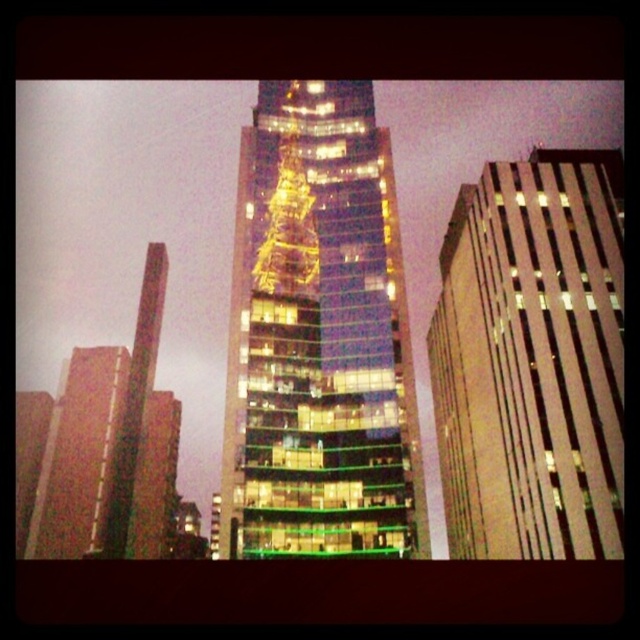
Does glass skyscraper at center appear on the left side of glassy reflective building at right?

Yes, glass skyscraper at center is to the left of glassy reflective building at right.

Who is more distant from viewer, (122, 262) or (589, 419)?

The point (122, 262) is behind.

What are the coordinates of `glass skyscraper at center` in the screenshot? It's located at (129, 230).

This screenshot has height=640, width=640. Find the location of `glass skyscraper at center`. glass skyscraper at center is located at coordinates (129, 230).

Can you confirm if glassy reflective skyscraper at center is taller than glassy reflective building at right?

Indeed, glassy reflective skyscraper at center has a greater height compared to glassy reflective building at right.

You are a GUI agent. You are given a task and a screenshot of the screen. Output one action in this format:
    pyautogui.click(x=<x>, y=<y>)
    Task: Click on the glassy reflective skyscraper at center
    The height and width of the screenshot is (640, 640).
    Given the screenshot: What is the action you would take?
    pyautogui.click(x=320, y=337)

Locate an element on the screen. glassy reflective skyscraper at center is located at coordinates (320, 337).

Can you confirm if glassy reflective building at right is smaller than glassy skyscraper at left?

Yes, glassy reflective building at right is smaller than glassy skyscraper at left.

Who is shorter, glassy reflective building at right or glassy skyscraper at left?

With less height is glassy reflective building at right.

The image size is (640, 640). Identify the location of glassy reflective building at right. (532, 358).

Identify the location of glassy reflective building at right. This screenshot has width=640, height=640. (532, 358).